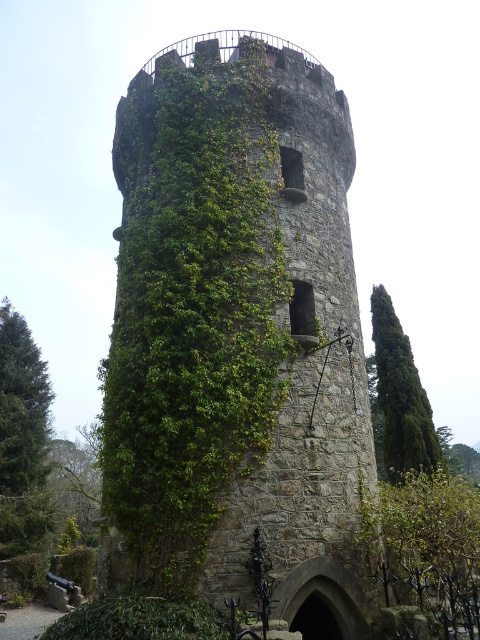
In the scene shown: Which is below, green leafy tree at left or green leafy tree at right?

green leafy tree at left

Which is above, green leafy tree at left or green leafy tree at right?

green leafy tree at right is above.

Between point (35, 490) and point (427, 452), which one is positioned behind?

The point (35, 490) is more distant.

Find the location of a particular element. The image size is (480, 640). green leafy tree at left is located at coordinates (23, 436).

Describe the element at coordinates (236, 336) in the screenshot. This screenshot has height=640, width=480. I see `green stone tower at center` at that location.

Is green stone tower at center further to camera compared to green leafy tree at right?

No, it is not.

Does point (237, 400) lie in front of point (418, 376)?

Yes, point (237, 400) is closer to viewer.

At what (x,y) coordinates should I click in order to perform the action: click on green stone tower at center. Please return your answer as a coordinate pair (x, y). Looking at the image, I should click on (236, 336).

Is point (199, 108) closer to viewer compared to point (15, 516)?

Yes.

Between green stone tower at center and green leafy tree at left, which one has more height?

green stone tower at center is taller.

Image resolution: width=480 pixels, height=640 pixels. In order to click on green stone tower at center in this screenshot , I will do `click(236, 336)`.

The height and width of the screenshot is (640, 480). I want to click on green stone tower at center, so click(236, 336).